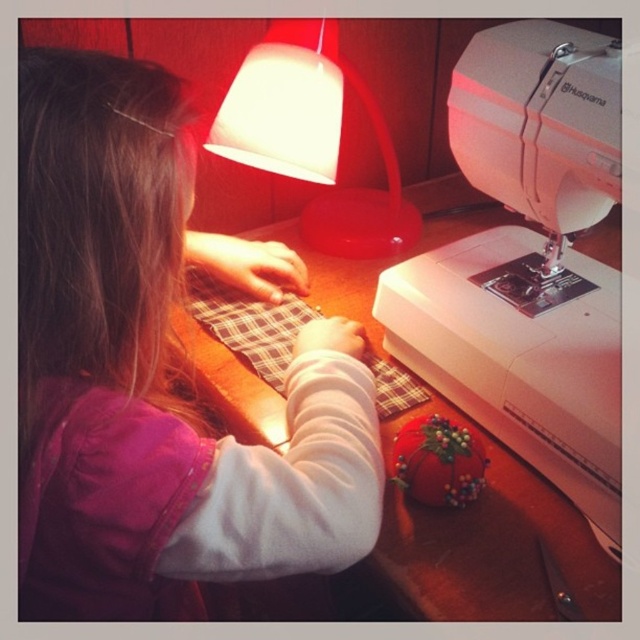
Question: Observing the image, what is the correct spatial positioning of pink fleece sweater at upper left in reference to wooden table at center?

Choices:
 (A) right
 (B) left

Answer: (B)

Question: Which of the following is the closest to the observer?

Choices:
 (A) (596, 60)
 (B) (385, 595)

Answer: (B)

Question: Can you confirm if pink fleece sweater at upper left is positioned to the left of wooden table at center?

Choices:
 (A) no
 (B) yes

Answer: (B)

Question: Does pink fleece sweater at upper left have a smaller size compared to white plastic sewing machine at right?

Choices:
 (A) yes
 (B) no

Answer: (B)

Question: Which of the following is the closest to the observer?

Choices:
 (A) pink fleece sweater at upper left
 (B) wooden table at center
 (C) matte plastic lamp at upper center
 (D) white plastic sewing machine at right

Answer: (A)

Question: Which object is closer to the camera taking this photo?

Choices:
 (A) white plastic sewing machine at right
 (B) pink fleece sweater at upper left
 (C) matte plastic lamp at upper center

Answer: (B)